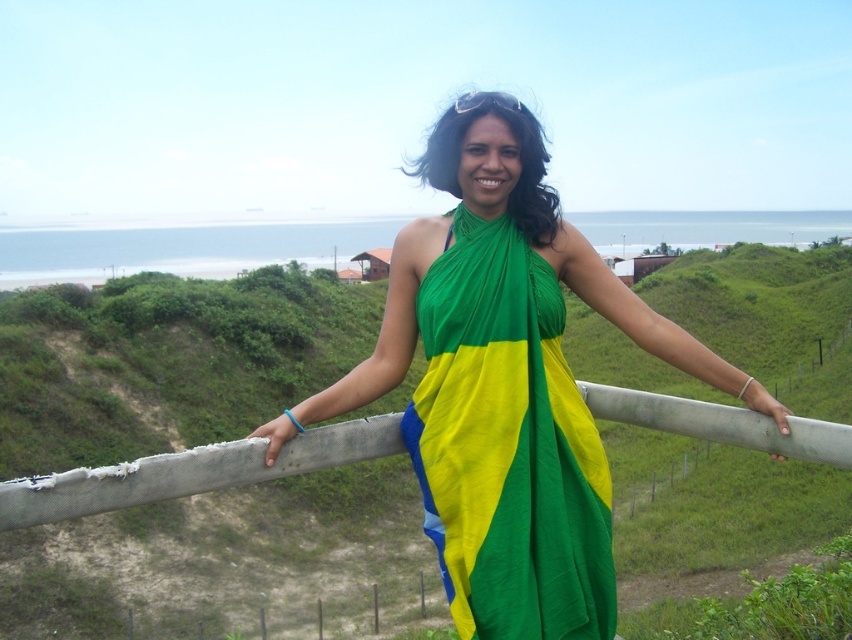
Question: Among these points, which one is nearest to the camera?

Choices:
 (A) (380, 394)
 (B) (542, 397)

Answer: (B)

Question: Does green fabric at center have a greater width compared to green fabric dress at center?

Choices:
 (A) yes
 (B) no

Answer: (B)

Question: Can you confirm if green fabric at center is positioned above green fabric dress at center?

Choices:
 (A) yes
 (B) no

Answer: (A)

Question: Does green fabric at center appear on the right side of green fabric dress at center?

Choices:
 (A) yes
 (B) no

Answer: (A)